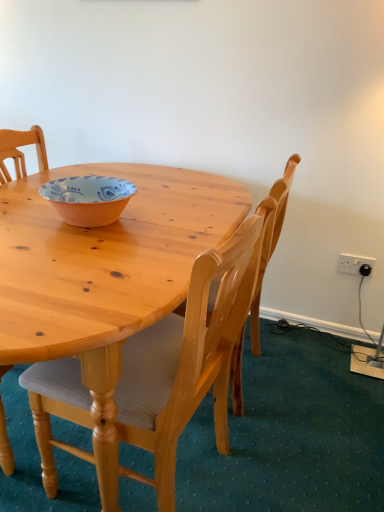
Where is `vacant area that is situated to the right of light brown wood chair at center, which is the second chair in front-to-back order`? Image resolution: width=384 pixels, height=512 pixels. vacant area that is situated to the right of light brown wood chair at center, which is the second chair in front-to-back order is located at coordinates (316, 403).